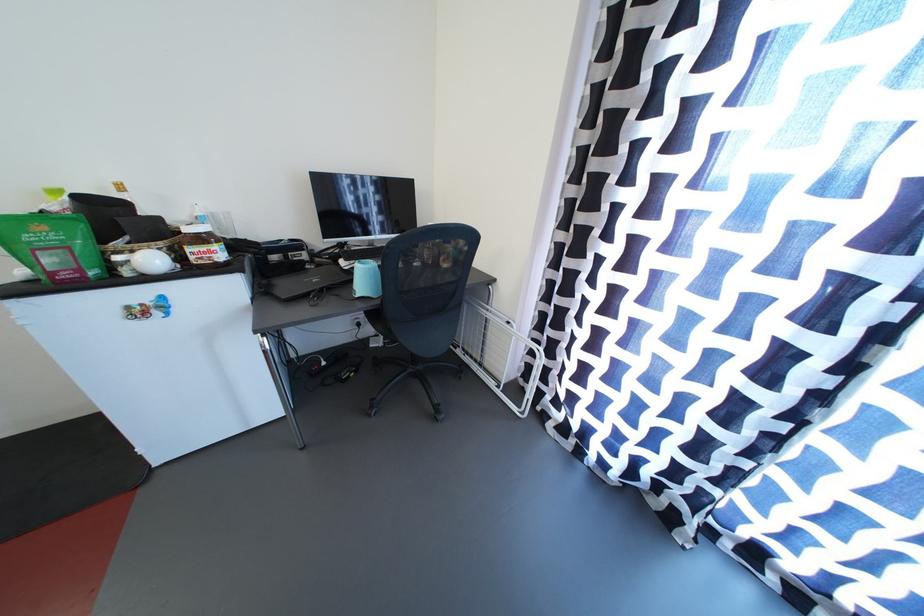
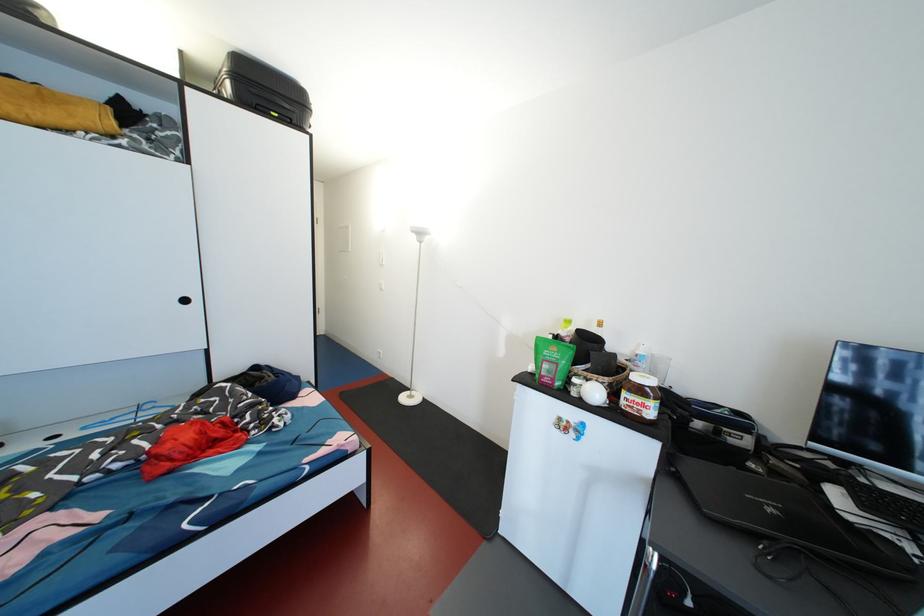
Where in the second image is the point corresponding to [195,235] from the first image?

(641, 383)